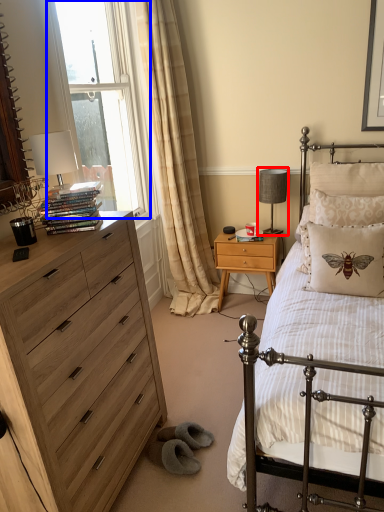
Question: Which point is closer to the camera, table lamp (highlighted by a red box) or window (highlighted by a blue box)?

Choices:
 (A) table lamp
 (B) window

Answer: (B)